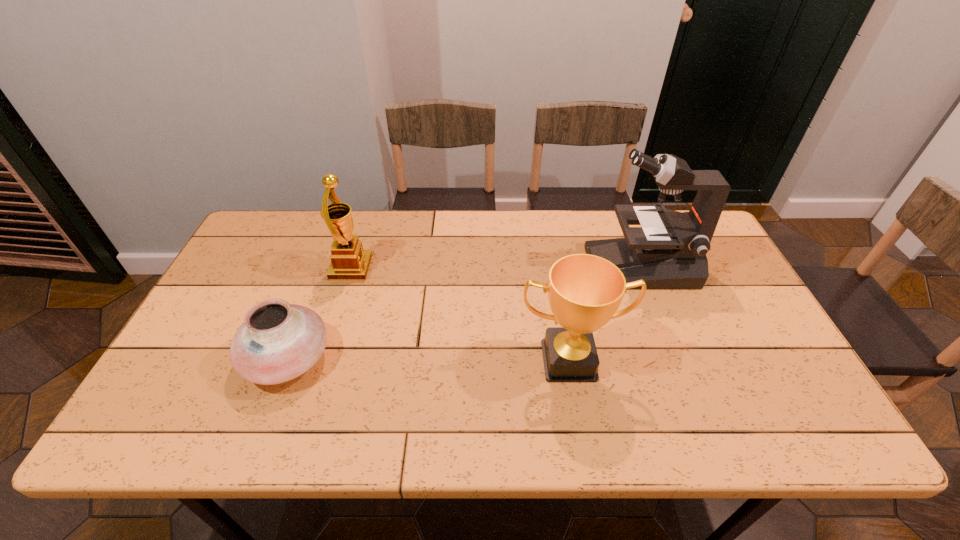
Image resolution: width=960 pixels, height=540 pixels. Identify the location of empty location between the farther award and the microscope. (495, 267).

This screenshot has height=540, width=960. Find the location of `free space between the tallest object and the farther award`. free space between the tallest object and the farther award is located at coordinates (495, 267).

Where is `free space that is in between the left award and the tallest object`? The image size is (960, 540). free space that is in between the left award and the tallest object is located at coordinates (495, 267).

Identify the location of free space between the farther award and the nearer award. This screenshot has height=540, width=960. (460, 314).

Where is `free space between the shortest object and the microscope`? The image size is (960, 540). free space between the shortest object and the microscope is located at coordinates (464, 312).

The image size is (960, 540). I want to click on vacant space that is in between the microscope and the pottery, so click(464, 312).

At what (x,y) coordinates should I click in order to perform the action: click on free space that is in between the shortest object and the farther award. Please return your answer as a coordinate pair (x, y). Looking at the image, I should click on 320,313.

The image size is (960, 540). What are the coordinates of `object identified as the second closest to the pottery` in the screenshot? It's located at (585, 291).

Identify which object is the third closest to the right award. Please provide its 2D coordinates. Your answer should be formatted as a tuple, i.e. [(x, y)], where the tuple contains the x and y coordinates of a point satisfying the conditions above.

[(349, 261)]

At what (x,y) coordinates should I click in order to perform the action: click on vacant space that satisfies the following two spatial constraints: 1. through the eyepieces of the tallest object; 2. on the front-facing side of the nearer award. Please return your answer as a coordinate pair (x, y). This screenshot has width=960, height=540. Looking at the image, I should click on (676, 360).